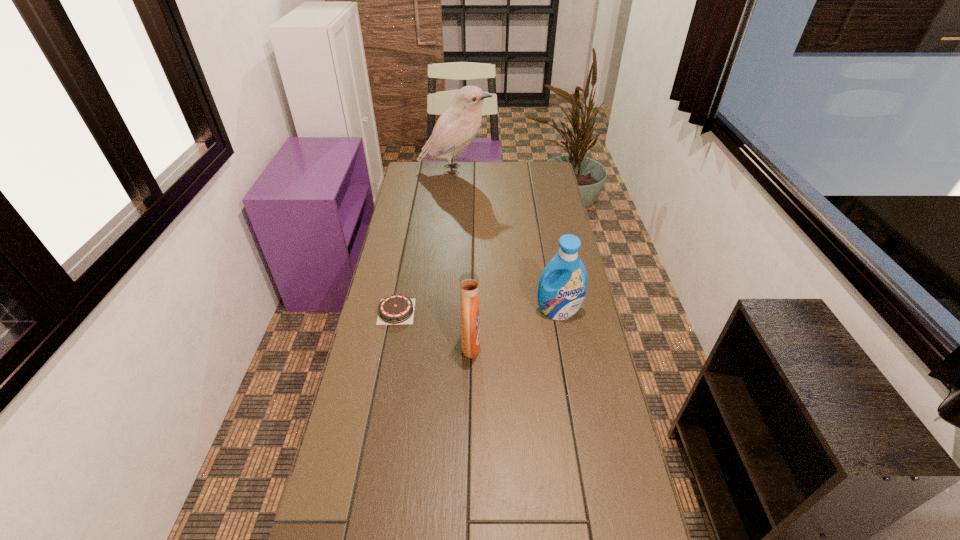
The width and height of the screenshot is (960, 540). I want to click on the farthest object, so click(456, 128).

Where is `parakeet`? This screenshot has width=960, height=540. parakeet is located at coordinates (456, 128).

Where is `the right detergent`? the right detergent is located at coordinates (560, 296).

Locate an element on the screen. Image resolution: width=960 pixels, height=540 pixels. the rightmost object is located at coordinates (560, 296).

Find the location of a particular element. The height and width of the screenshot is (540, 960). the nearest object is located at coordinates (469, 282).

Find the location of a particular element. This screenshot has height=540, width=960. the nearer detergent is located at coordinates (469, 282).

This screenshot has width=960, height=540. In order to click on the shortest object in this screenshot , I will do `click(396, 309)`.

Where is `free space located 0.160m on the face of the farthest object`? free space located 0.160m on the face of the farthest object is located at coordinates (523, 170).

The width and height of the screenshot is (960, 540). I want to click on vacant space located on the front-facing side of the rightmost object, so click(565, 349).

Where is `vacant space situated 0.200m on the front-facing side of the nearer detergent`? Image resolution: width=960 pixels, height=540 pixels. vacant space situated 0.200m on the front-facing side of the nearer detergent is located at coordinates (544, 346).